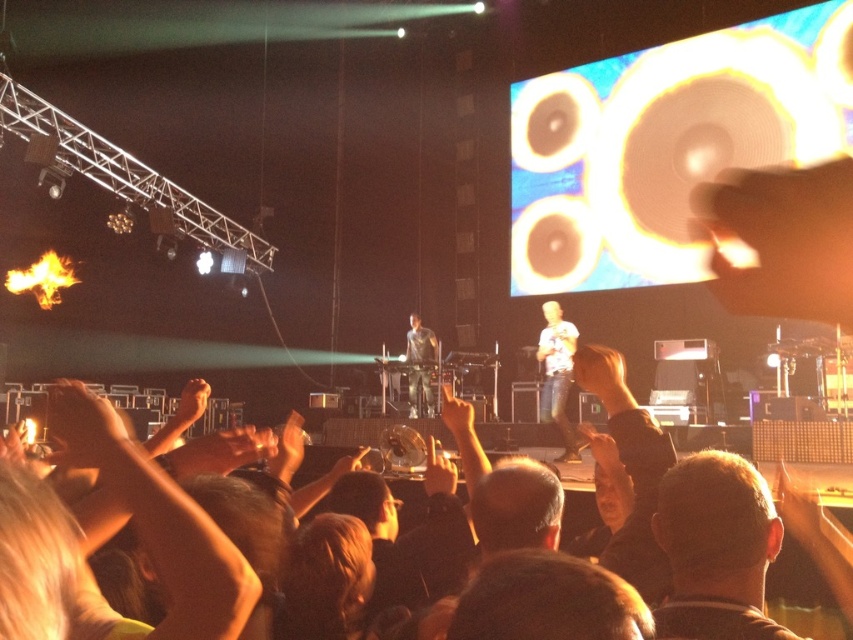
Question: Is white cotton shirt at center to the left of dark gray shirt at center from the viewer's perspective?

Choices:
 (A) no
 (B) yes

Answer: (A)

Question: Is white cotton shirt at center to the left of dark gray shirt at center from the viewer's perspective?

Choices:
 (A) yes
 (B) no

Answer: (B)

Question: Which of the following is the farthest from the observer?

Choices:
 (A) (578, 456)
 (B) (413, 410)

Answer: (B)

Question: Can you confirm if white cotton shirt at center is smaller than dark gray shirt at center?

Choices:
 (A) no
 (B) yes

Answer: (A)

Question: Which of the following is the farthest from the observer?

Choices:
 (A) white cotton shirt at center
 (B) dark gray shirt at center

Answer: (B)